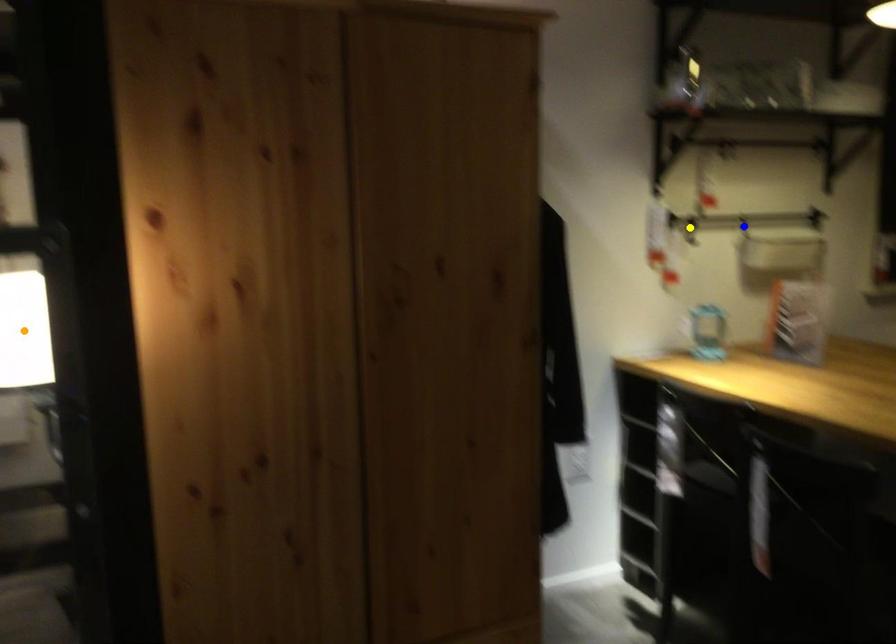
Order these from farthest to nearest:
blue point
orange point
yellow point

blue point, yellow point, orange point